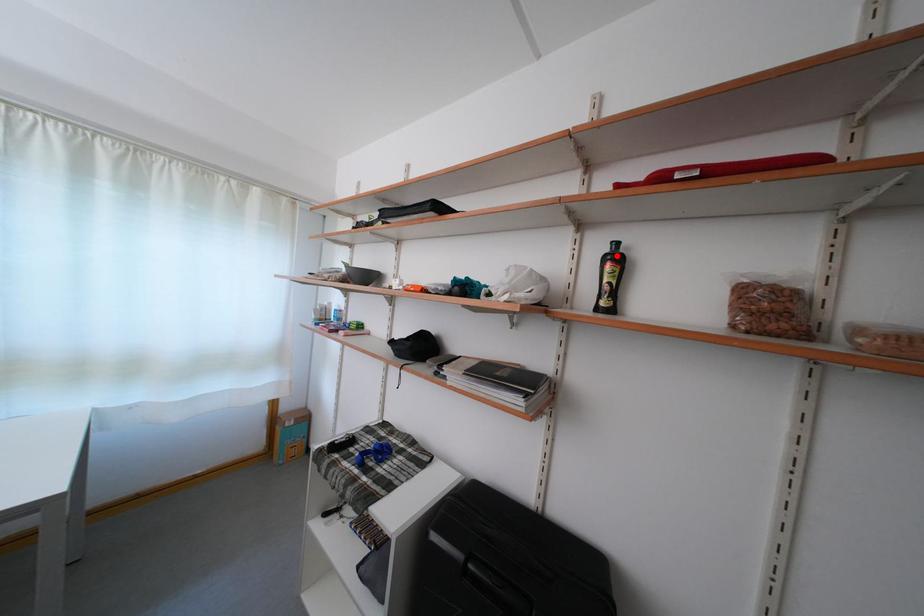
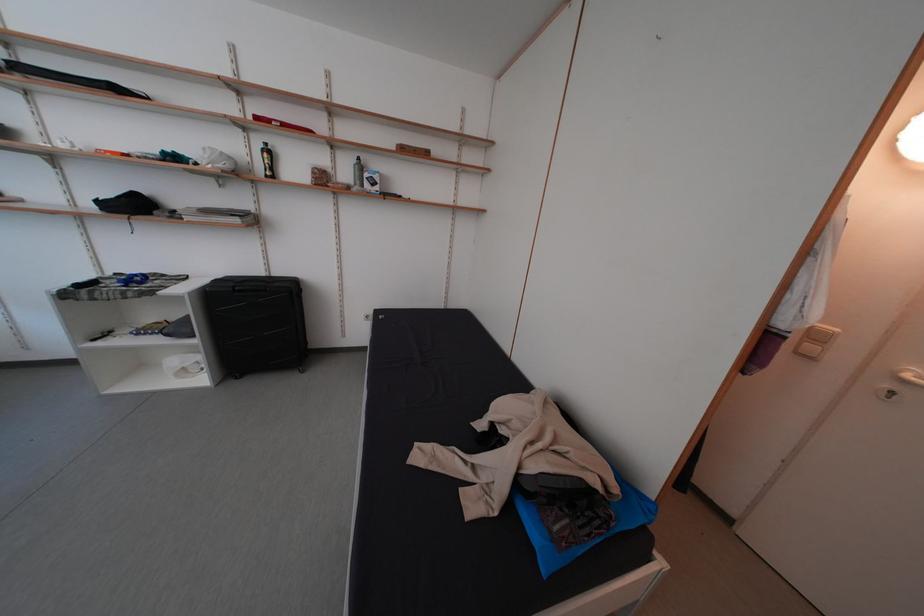
Locate, in the second image, the point that corresponds to the highlighted location in the first image.

(272, 152)